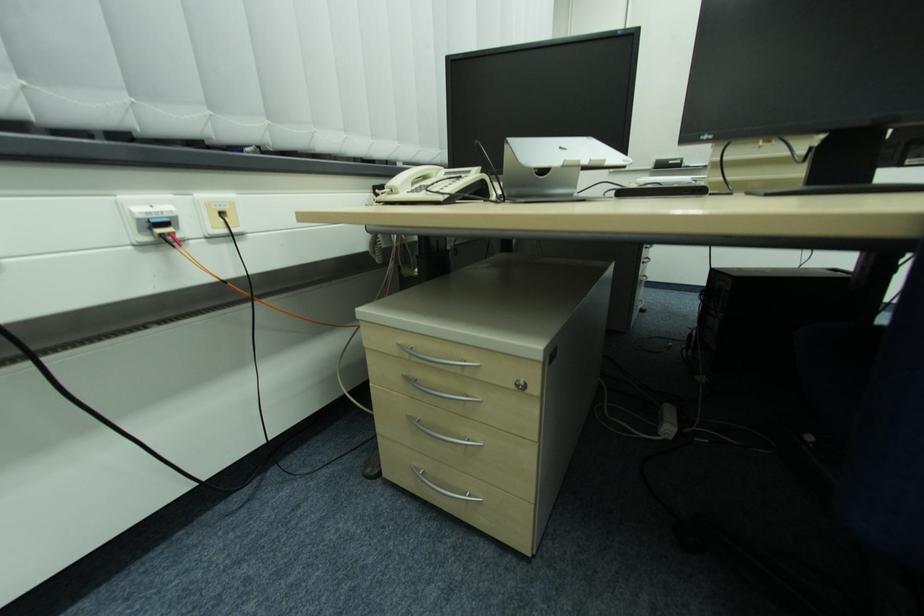
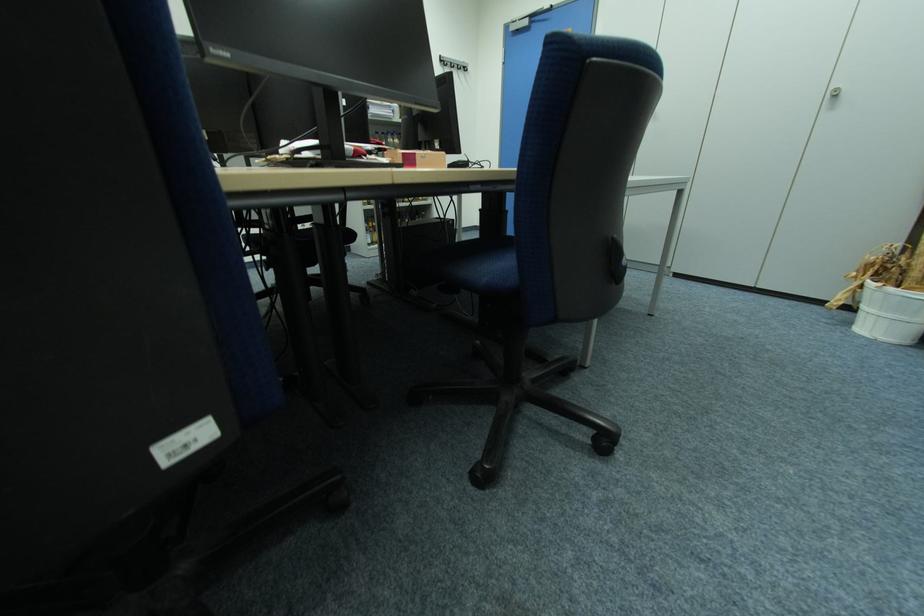
How did the camera likely rotate?

The camera rotated toward right-down.